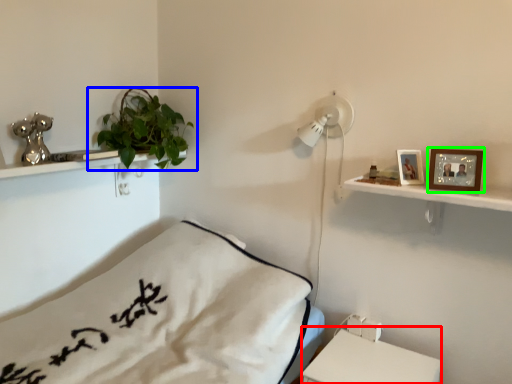
Question: Which object is positioned farthest from table (highlighted by a red box)? Select from houseplant (highlighted by a blue box) and picture frame (highlighted by a green box).

Choices:
 (A) houseplant
 (B) picture frame

Answer: (A)